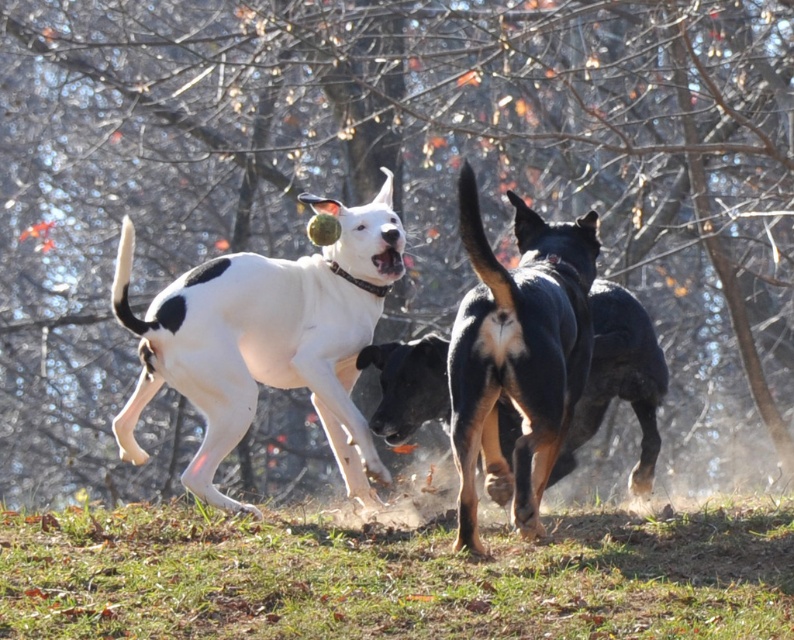
Does green grass at lower center have a smaller size compared to white matte dog at center?

Correct, green grass at lower center occupies less space than white matte dog at center.

Does green grass at lower center appear under white matte dog at center?

Yes.

Is point (125, 608) in front of point (133, 451)?

Yes, it is.

Where is `green grass at lower center`? The image size is (794, 640). green grass at lower center is located at coordinates (395, 577).

How far apart are green grass at lower center and black glossy dog at center?

36.77 inches

The height and width of the screenshot is (640, 794). Identify the location of green grass at lower center. (395, 577).

You are a GUI agent. You are given a task and a screenshot of the screen. Output one action in this format:
    pyautogui.click(x=<x>, y=<y>)
    Task: Click on the green grass at lower center
    The height and width of the screenshot is (640, 794).
    Given the screenshot: What is the action you would take?
    pyautogui.click(x=395, y=577)

Does green grass at lower center appear on the right side of black fur dog at center?

Incorrect, green grass at lower center is not on the right side of black fur dog at center.

Based on the photo, which of these two, green grass at lower center or black fur dog at center, stands taller?

Standing taller between the two is black fur dog at center.

Is point (688, 577) more distant than point (534, 522)?

No.

Locate an element on the screen. The height and width of the screenshot is (640, 794). green grass at lower center is located at coordinates (395, 577).